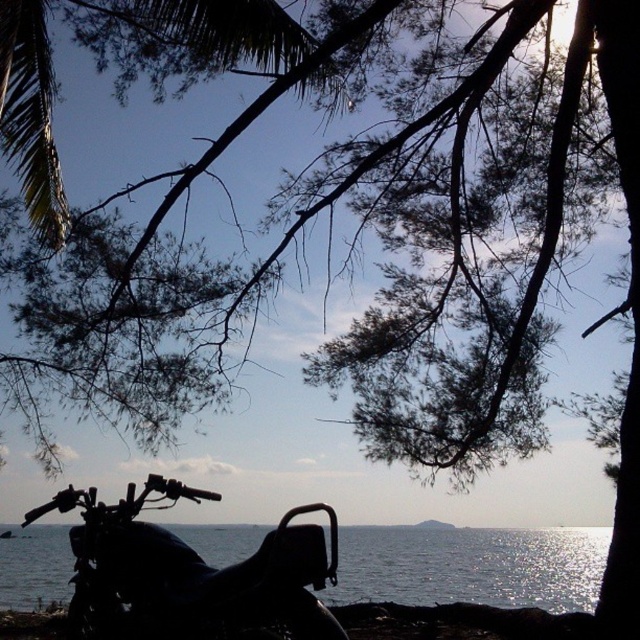
Question: Can you confirm if black matte motorcycle at lower left is bigger than transparent water at lower center?

Choices:
 (A) no
 (B) yes

Answer: (B)

Question: Among these objects, which one is nearest to the camera?

Choices:
 (A) transparent water at lower center
 (B) black matte motorcycle at lower left

Answer: (B)

Question: Is black matte motorcycle at lower left above transparent water at lower center?

Choices:
 (A) no
 (B) yes

Answer: (B)

Question: Which point is closer to the camera taking this photo?

Choices:
 (A) (296, 628)
 (B) (52, 588)

Answer: (A)

Question: From the image, what is the correct spatial relationship of black matte motorcycle at lower left in relation to transparent water at lower center?

Choices:
 (A) above
 (B) below

Answer: (A)